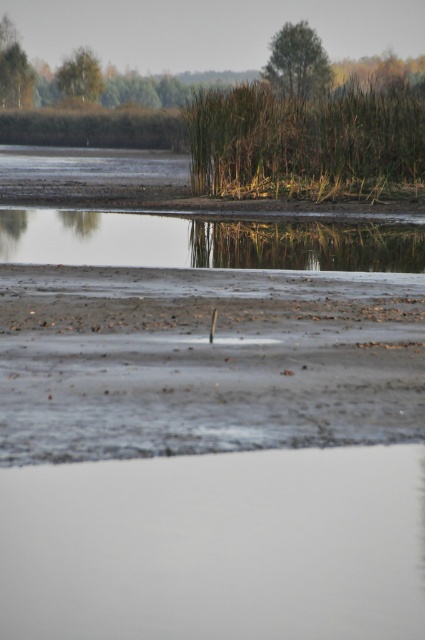
You are standing in the wetland scene and want to walk from the point closer to you to the point further away. Which path would you take between the two points, point (353, 428) and point (65, 211)?

You should walk from point (353, 428) to point (65, 211) because point (353, 428) is closer to the viewer and the other point is further away.

You are a photographer standing at the lower edge of the image, aiming to capture the brown grass at upper center. Based on its position coordinates, can you estimate whether it will be in the center of your frame or off to one side?

The brown grass at upper center is located at coordinates point (306,141). Since the x coordinate is 0.222, which is less than 0.5, it would be positioned to the left side of the frame rather than the center.

You are standing on the gray sandy beach at center and want to reach the smooth reflective water at center. Which direction should you walk to get there?

You should walk to the left because the gray sandy beach at center is to the right of the smooth reflective water at center, so moving left will take you towards the water.